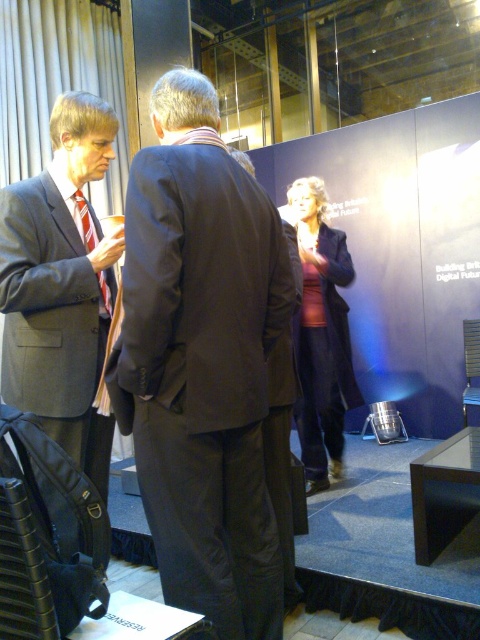
You are organizing a photo shoot and need to know the relative sizes of the suits in the image. Which of the two suits, the dark gray suit at center or the matte gray suit at left, is wider?

The dark gray suit at center is wider than the matte gray suit at left according to the description.